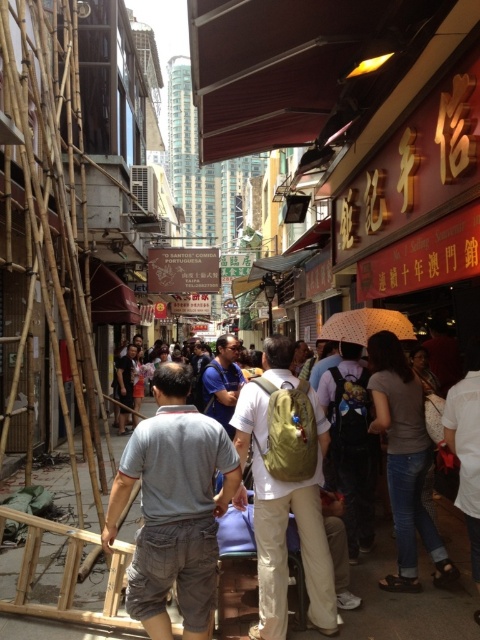
Does light blue fabric at center have a smaller size compared to blue fabric shirt at center?

Indeed, light blue fabric at center has a smaller size compared to blue fabric shirt at center.

Does light blue fabric at center appear on the right side of blue fabric shirt at center?

Indeed, light blue fabric at center is positioned on the right side of blue fabric shirt at center.

Measure the distance between point (422,605) and camera.

The distance of point (422,605) from camera is 5.70 meters.

I want to click on light blue fabric at center, so (419, 593).

Who is more forward, [146,474] or [286,584]?

Positioned in front is point [146,474].

The width and height of the screenshot is (480, 640). Find the location of `gray fabric pants at center`. gray fabric pants at center is located at coordinates (173, 508).

Does gray fabric pants at center lie behind white matte umbrella at center?

That is False.

Between gray fabric pants at center and white matte umbrella at center, which one has more height?

gray fabric pants at center

Does point (187, 477) come in front of point (383, 323)?

That is True.

Where is `gray fabric pants at center`? gray fabric pants at center is located at coordinates (173, 508).